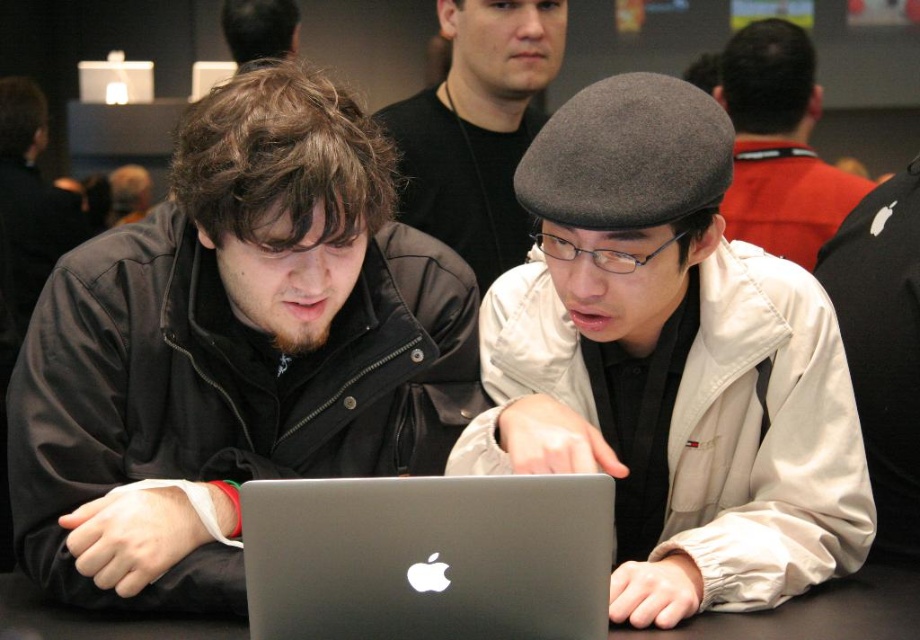
Does matte black jacket at left have a greater height compared to gray wool beret at upper right?

Yes, matte black jacket at left is taller than gray wool beret at upper right.

Who is taller, matte black jacket at left or gray wool beret at upper right?

Standing taller between the two is matte black jacket at left.

The image size is (920, 640). Describe the element at coordinates (236, 344) in the screenshot. I see `matte black jacket at left` at that location.

You are a GUI agent. You are given a task and a screenshot of the screen. Output one action in this format:
    pyautogui.click(x=<x>, y=<y>)
    Task: Click on the matte black jacket at left
    This screenshot has width=920, height=640.
    Given the screenshot: What is the action you would take?
    pyautogui.click(x=236, y=344)

Can you confirm if matte black jacket at left is positioned above matte gray hat at center?

Incorrect, matte black jacket at left is not positioned above matte gray hat at center.

Who is higher up, matte black jacket at left or matte gray hat at center?

matte gray hat at center is above.

The image size is (920, 640). Find the location of `matte black jacket at left`. matte black jacket at left is located at coordinates (236, 344).

Locate an element on the screen. This screenshot has height=640, width=920. matte black jacket at left is located at coordinates (236, 344).

Can you confirm if matte black jacket at left is shorter than matte black shirt at upper center?

No.

Identify the location of matte black jacket at left. (236, 344).

Between point (289, 204) and point (446, 211), which one is positioned in front?

Positioned in front is point (289, 204).

Image resolution: width=920 pixels, height=640 pixels. In order to click on matte black jacket at left in this screenshot , I will do `click(236, 344)`.